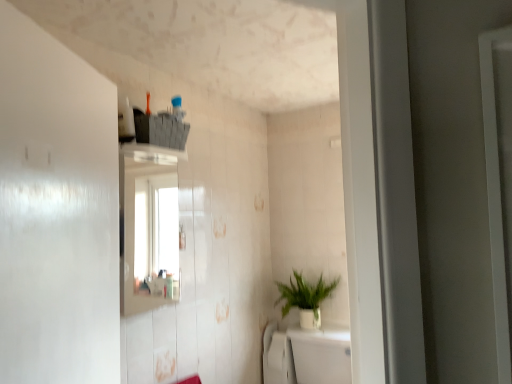
Question: From a real-world perspective, is white glossy bath at lower center over green matte plant at center?

Choices:
 (A) no
 (B) yes

Answer: (A)

Question: Can you confirm if white glossy bath at lower center is thinner than green matte plant at center?

Choices:
 (A) no
 (B) yes

Answer: (A)

Question: Would you consider white glossy bath at lower center to be distant from green matte plant at center?

Choices:
 (A) no
 (B) yes

Answer: (A)

Question: Considering the relative sizes of white glossy bath at lower center and green matte plant at center in the image provided, is white glossy bath at lower center shorter than green matte plant at center?

Choices:
 (A) no
 (B) yes

Answer: (A)

Question: Can you confirm if white glossy bath at lower center is positioned to the right of green matte plant at center?

Choices:
 (A) no
 (B) yes

Answer: (B)

Question: From the image's perspective, is white glossy bath at lower center under green matte plant at center?

Choices:
 (A) yes
 (B) no

Answer: (A)

Question: Can white glossy bath at lower center be found inside green matte plant at center?

Choices:
 (A) no
 (B) yes

Answer: (A)

Question: Can you confirm if green matte plant at center is smaller than white glossy bath at lower center?

Choices:
 (A) yes
 (B) no

Answer: (A)

Question: From the image's perspective, is green matte plant at center on top of white glossy bath at lower center?

Choices:
 (A) yes
 (B) no

Answer: (A)

Question: Is green matte plant at center not inside white glossy bath at lower center?

Choices:
 (A) yes
 (B) no

Answer: (A)

Question: Can you confirm if green matte plant at center is wider than white glossy bath at lower center?

Choices:
 (A) no
 (B) yes

Answer: (A)

Question: From the image's perspective, is green matte plant at center beneath white glossy bath at lower center?

Choices:
 (A) yes
 (B) no

Answer: (B)

Question: Is green matte plant at center situated inside white glossy bath at lower center or outside?

Choices:
 (A) inside
 (B) outside

Answer: (B)